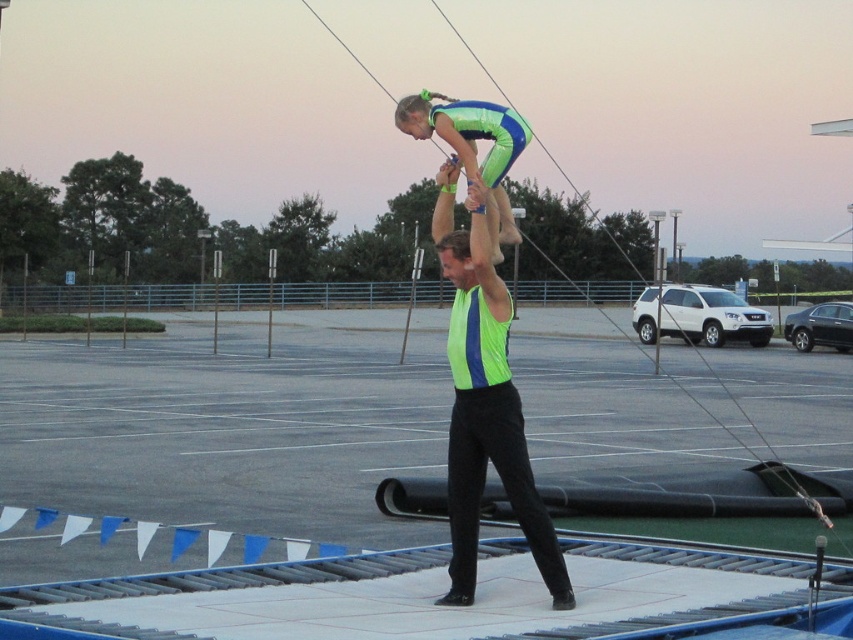
You are a safety inspector checking the acrobatic setup. The safety vest must be wider than the head to ensure proper protection. Does the neon green fabric safety vest at center meet this requirement compared to the green fabric head at center?

Yes, the neon green fabric safety vest at center is wider than the green fabric head at center, meeting the safety requirement.